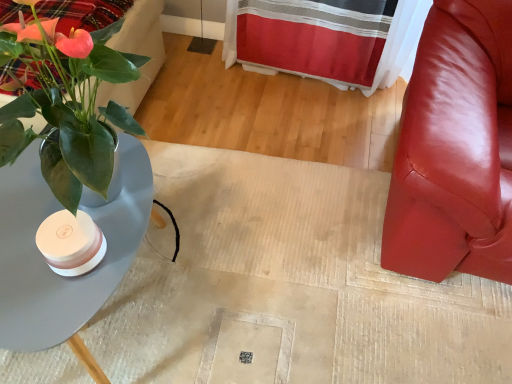
Where is `free space between matte gray table at left and glossy leather chair at right`? free space between matte gray table at left and glossy leather chair at right is located at coordinates (288, 223).